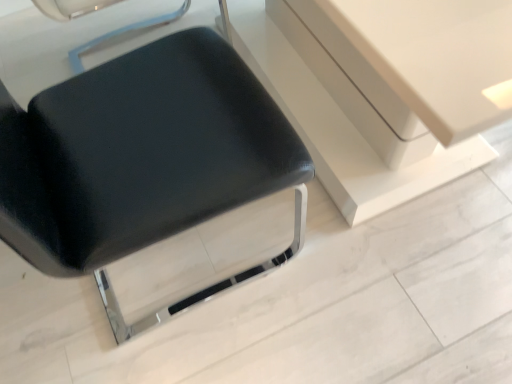
Question: Considering the positions of matte black vanity at center and black leather chair at center in the image, is matte black vanity at center wider or thinner than black leather chair at center?

Choices:
 (A) thin
 (B) wide

Answer: (B)

Question: From the image's perspective, is matte black vanity at center located above or below black leather chair at center?

Choices:
 (A) above
 (B) below

Answer: (A)

Question: Considering the positions of matte black vanity at center and black leather chair at center in the image, is matte black vanity at center taller or shorter than black leather chair at center?

Choices:
 (A) tall
 (B) short

Answer: (B)

Question: From their relative heights in the image, would you say black leather chair at center is taller or shorter than matte black vanity at center?

Choices:
 (A) tall
 (B) short

Answer: (A)

Question: Would you say black leather chair at center is to the left or to the right of matte black vanity at center in the picture?

Choices:
 (A) right
 (B) left

Answer: (B)

Question: From the image's perspective, is black leather chair at center positioned above or below matte black vanity at center?

Choices:
 (A) above
 (B) below

Answer: (B)

Question: Is black leather chair at center situated inside matte black vanity at center or outside?

Choices:
 (A) outside
 (B) inside

Answer: (A)